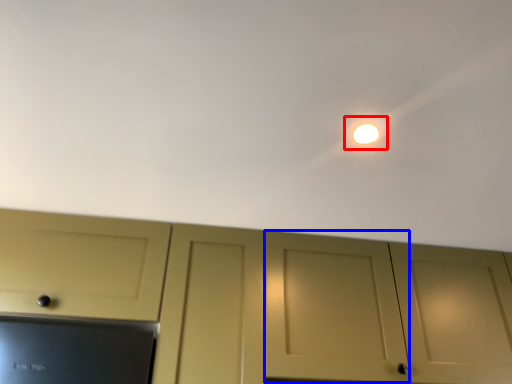
Question: Which of the following is the farthest to the observer, light (highlighted by a red box) or door (highlighted by a blue box)?

Choices:
 (A) light
 (B) door

Answer: (B)